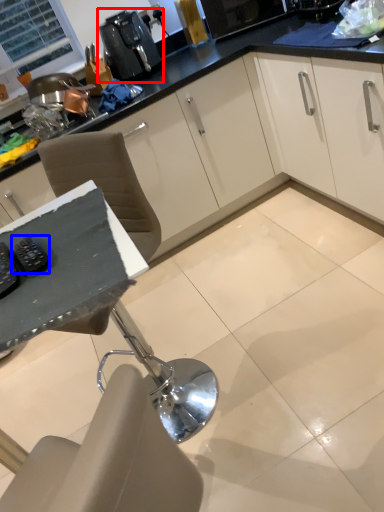
Question: Which point is closer to the camera, coffee machine (highlighted by a red box) or appliance (highlighted by a blue box)?

Choices:
 (A) coffee machine
 (B) appliance

Answer: (B)